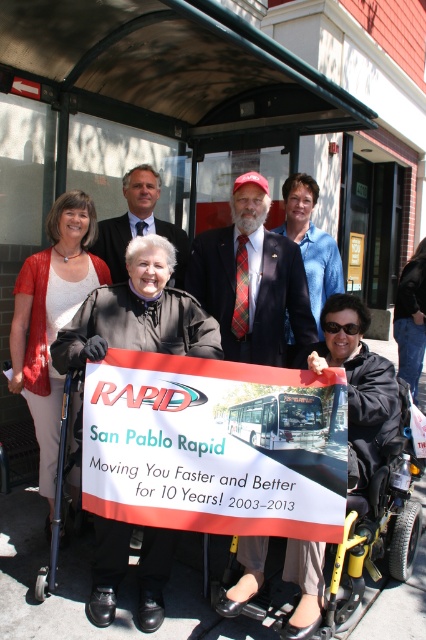
Question: Is white paper sign at center thinner than plaid fabric tie at center?

Choices:
 (A) yes
 (B) no

Answer: (B)

Question: Which point is farther to the camera?

Choices:
 (A) (268, 304)
 (B) (163, 449)

Answer: (A)

Question: Does plaid tie at center appear over metallic silver wheelchair at lower left?

Choices:
 (A) no
 (B) yes

Answer: (B)

Question: Which point is farther to the camera?

Choices:
 (A) (55, 538)
 (B) (147, 228)
 (C) (273, 364)
 (D) (152, 356)

Answer: (B)

Question: Which point is farther from the camera taking this photo?

Choices:
 (A) (54, 586)
 (B) (124, 173)
 (C) (247, 499)
 (D) (245, 234)

Answer: (B)

Question: Can you confirm if white paper sign at center is positioned above plaid fabric tie at center?

Choices:
 (A) yes
 (B) no

Answer: (B)